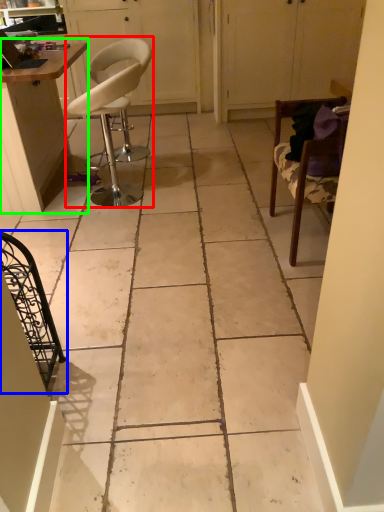
Question: Based on their relative distances, which object is farther from chair (highlighted by a red box)? Choose from chair (highlighted by a blue box) and table (highlighted by a green box).

Choices:
 (A) chair
 (B) table

Answer: (A)